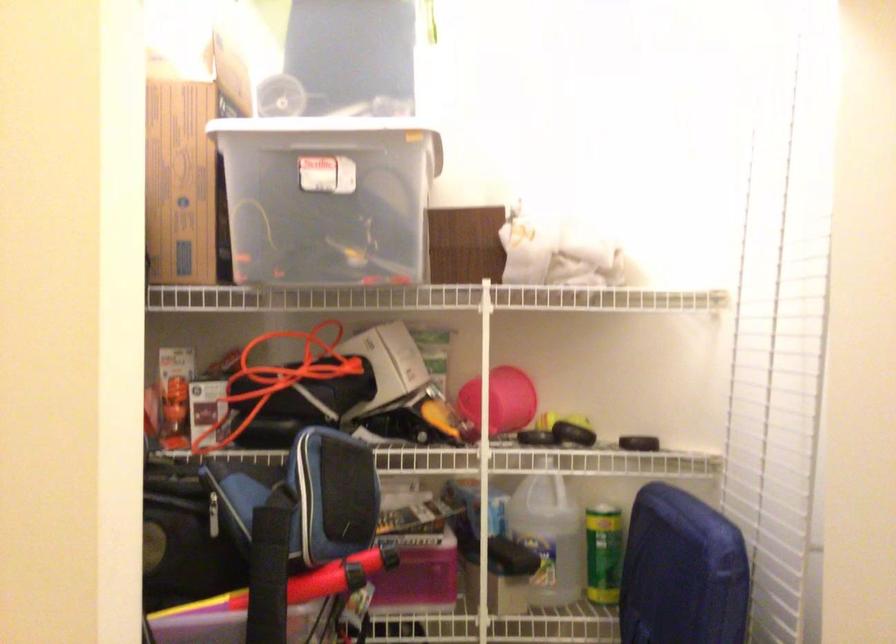
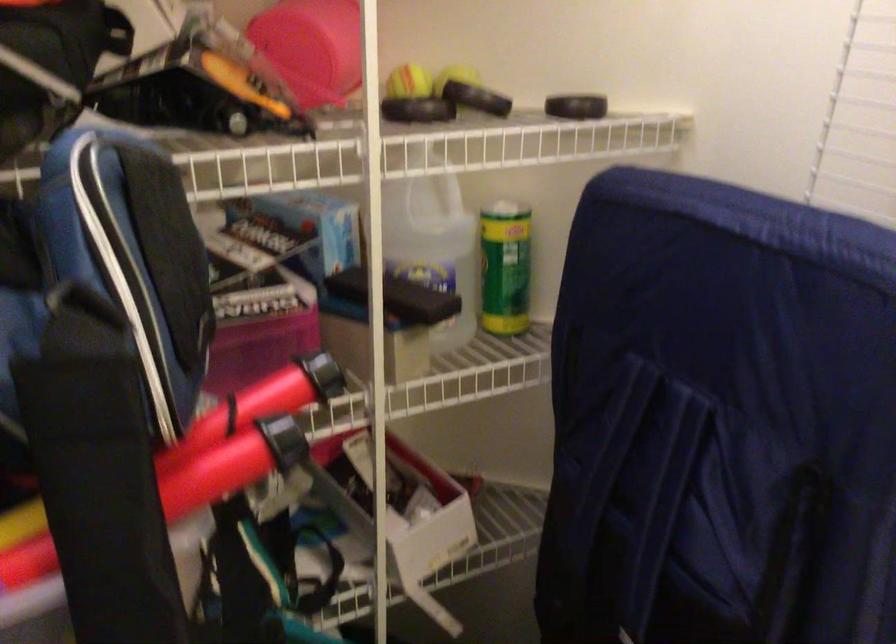
How did the camera likely rotate?

The camera rotated toward right-down.